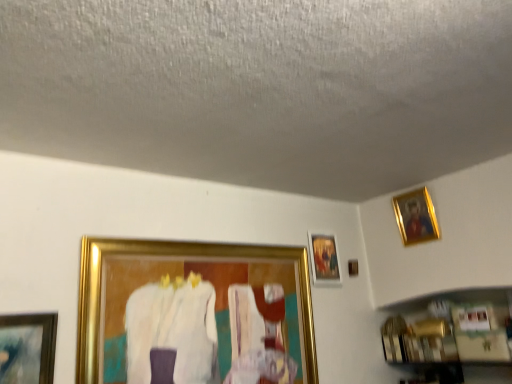
In order to face gold metallic picture frame at upper right, the 3th picture frame positioned from the left, should I rotate leftwards or rightwards?

Turn right approximately 20.600 degrees to face it.

The image size is (512, 384). Describe the element at coordinates (177, 256) in the screenshot. I see `gold metallic picture frame at center-left, which is the first picture frame from left to right` at that location.

The height and width of the screenshot is (384, 512). What are the coordinates of `gold-framed painting at upper right, which is the second picture frame from left to right` in the screenshot? It's located at (324, 259).

Is gold-framed painting at upper right, which is counted as the second picture frame, starting from the right, positioned in front of gold metallic picture frame at upper right, the 3th picture frame positioned from the left?

No, it is not.

Could you measure the distance between gold-framed painting at upper right, which is counted as the second picture frame, starting from the right, and gold metallic picture frame at upper right, which is counted as the first picture frame, starting from the right?

They are 21.06 inches apart.

Is point (334, 241) closer or farther from the camera than point (426, 239)?

Point (334, 241) appears to be farther away from the viewer than point (426, 239).

How many degrees apart are the facing directions of gold metallic picture frame at upper right, the 3th picture frame positioned from the left, and gold-framed painting at upper right, which is the second picture frame from left to right?

They differ by 87.7 degrees in their facing directions.

How far apart are gold metallic picture frame at upper right, which is counted as the first picture frame, starting from the right, and gold-framed painting at upper right, which is the second picture frame from left to right?

gold metallic picture frame at upper right, which is counted as the first picture frame, starting from the right, is 21.06 inches away from gold-framed painting at upper right, which is the second picture frame from left to right.

Can gold-framed painting at upper right, which is counted as the second picture frame, starting from the right, be found inside gold metallic picture frame at upper right, the 3th picture frame positioned from the left?

No, gold-framed painting at upper right, which is counted as the second picture frame, starting from the right, is not surrounded by gold metallic picture frame at upper right, the 3th picture frame positioned from the left.

From a real-world perspective, is gold metallic picture frame at upper right, which is counted as the first picture frame, starting from the right, positioned above or below gold-framed painting at upper right, which is the second picture frame from left to right?

From a real-world perspective, gold metallic picture frame at upper right, which is counted as the first picture frame, starting from the right, is physically above gold-framed painting at upper right, which is the second picture frame from left to right.

Which object is thinner, gold metallic picture frame at upper right, the 3th picture frame positioned from the left, or gold metallic picture frame at center-left, arranged as the third picture frame when viewed from the right?

Thinner between the two is gold metallic picture frame at upper right, the 3th picture frame positioned from the left.

Measure the distance between gold metallic picture frame at upper right, which is counted as the first picture frame, starting from the right, and gold metallic picture frame at center-left, which is the first picture frame from left to right.

The distance of gold metallic picture frame at upper right, which is counted as the first picture frame, starting from the right, from gold metallic picture frame at center-left, which is the first picture frame from left to right, is 37.17 inches.

Who is taller, gold metallic picture frame at upper right, the 3th picture frame positioned from the left, or gold metallic picture frame at center-left, which is the first picture frame from left to right?

With more height is gold metallic picture frame at center-left, which is the first picture frame from left to right.

Considering the relative sizes of gold metallic picture frame at upper right, the 3th picture frame positioned from the left, and gold metallic picture frame at center-left, arranged as the third picture frame when viewed from the right, in the image provided, is gold metallic picture frame at upper right, the 3th picture frame positioned from the left, smaller than gold metallic picture frame at center-left, arranged as the third picture frame when viewed from the right,?

Correct, gold metallic picture frame at upper right, the 3th picture frame positioned from the left, occupies less space than gold metallic picture frame at center-left, arranged as the third picture frame when viewed from the right.

Between gold metallic picture frame at center-left, which is the first picture frame from left to right, and gold-framed painting at upper right, which is the second picture frame from left to right, which one appears on the right side from the viewer's perspective?

Positioned to the right is gold-framed painting at upper right, which is the second picture frame from left to right.

Considering the relative sizes of gold metallic picture frame at center-left, which is the first picture frame from left to right, and gold-framed painting at upper right, which is the second picture frame from left to right, in the image provided, is gold metallic picture frame at center-left, which is the first picture frame from left to right, wider than gold-framed painting at upper right, which is the second picture frame from left to right,?

Indeed, gold metallic picture frame at center-left, which is the first picture frame from left to right, has a greater width compared to gold-framed painting at upper right, which is the second picture frame from left to right.

Which of these two, gold metallic picture frame at center-left, which is the first picture frame from left to right, or gold-framed painting at upper right, which is counted as the second picture frame, starting from the right, is bigger?

gold metallic picture frame at center-left, which is the first picture frame from left to right.

Measure the distance between gold metallic picture frame at center-left, which is the first picture frame from left to right, and gold-framed painting at upper right, which is counted as the second picture frame, starting from the right.

A distance of 19.14 inches exists between gold metallic picture frame at center-left, which is the first picture frame from left to right, and gold-framed painting at upper right, which is counted as the second picture frame, starting from the right.

Can you see gold metallic picture frame at center-left, arranged as the third picture frame when viewed from the right, touching gold metallic picture frame at upper right, the 3th picture frame positioned from the left?

No, gold metallic picture frame at center-left, arranged as the third picture frame when viewed from the right, is not beside gold metallic picture frame at upper right, the 3th picture frame positioned from the left.

Can gold metallic picture frame at upper right, which is counted as the first picture frame, starting from the right, be found inside gold metallic picture frame at center-left, which is the first picture frame from left to right?

No, gold metallic picture frame at upper right, which is counted as the first picture frame, starting from the right, is not a part of gold metallic picture frame at center-left, which is the first picture frame from left to right.

From the image's perspective, is gold metallic picture frame at center-left, which is the first picture frame from left to right, above or below gold metallic picture frame at upper right, the 3th picture frame positioned from the left?

gold metallic picture frame at center-left, which is the first picture frame from left to right, is situated lower than gold metallic picture frame at upper right, the 3th picture frame positioned from the left, in the image.

From the image's perspective, starting from the gold metallic picture frame at upper right, which is counted as the first picture frame, starting from the right, which picture frame is the 2nd one below? Please provide its 2D coordinates.

[(177, 256)]

Does gold-framed painting at upper right, which is counted as the second picture frame, starting from the right, have a greater height compared to gold metallic picture frame at center-left, arranged as the third picture frame when viewed from the right?

No, gold-framed painting at upper right, which is counted as the second picture frame, starting from the right, is not taller than gold metallic picture frame at center-left, arranged as the third picture frame when viewed from the right.

Considering the sizes of objects gold-framed painting at upper right, which is counted as the second picture frame, starting from the right, and gold metallic picture frame at center-left, arranged as the third picture frame when viewed from the right, in the image provided, who is thinner, gold-framed painting at upper right, which is counted as the second picture frame, starting from the right, or gold metallic picture frame at center-left, arranged as the third picture frame when viewed from the right,?

Thinner between the two is gold-framed painting at upper right, which is counted as the second picture frame, starting from the right.

Where is `picture frame that is on the left side of gold-framed painting at upper right, which is the second picture frame from left to right`? Image resolution: width=512 pixels, height=384 pixels. picture frame that is on the left side of gold-framed painting at upper right, which is the second picture frame from left to right is located at coordinates (177, 256).

Which object is closer to the camera taking this photo, gold-framed painting at upper right, which is counted as the second picture frame, starting from the right, or gold metallic picture frame at center-left, which is the first picture frame from left to right?

gold metallic picture frame at center-left, which is the first picture frame from left to right, is closer to the camera.

In order to click on picture frame behind the gold metallic picture frame at upper right, which is counted as the first picture frame, starting from the right in this screenshot , I will do `click(324, 259)`.

In the image, there is a gold-framed painting at upper right, which is the second picture frame from left to right. At what (x,y) coordinates should I click in order to perform the action: click on picture frame above it (from the image's perspective). Please return your answer as a coordinate pair (x, y). The width and height of the screenshot is (512, 384). Looking at the image, I should click on (416, 217).

From the image, which object appears to be nearer to gold metallic picture frame at upper right, which is counted as the first picture frame, starting from the right, gold-framed painting at upper right, which is counted as the second picture frame, starting from the right, or gold metallic picture frame at center-left, which is the first picture frame from left to right?

gold-framed painting at upper right, which is counted as the second picture frame, starting from the right.

Based on their spatial positions, is gold metallic picture frame at upper right, which is counted as the first picture frame, starting from the right, or gold-framed painting at upper right, which is the second picture frame from left to right, further from gold metallic picture frame at center-left, which is the first picture frame from left to right?

gold metallic picture frame at upper right, which is counted as the first picture frame, starting from the right, is further to gold metallic picture frame at center-left, which is the first picture frame from left to right.

Looking at the image, which one is located further to gold-framed painting at upper right, which is counted as the second picture frame, starting from the right, gold metallic picture frame at center-left, arranged as the third picture frame when viewed from the right, or gold metallic picture frame at upper right, which is counted as the first picture frame, starting from the right?

gold metallic picture frame at upper right, which is counted as the first picture frame, starting from the right, lies further to gold-framed painting at upper right, which is counted as the second picture frame, starting from the right, than the other object.

Looking at the image, which one is located closer to gold-framed painting at upper right, which is the second picture frame from left to right, gold metallic picture frame at upper right, the 3th picture frame positioned from the left, or gold metallic picture frame at center-left, which is the first picture frame from left to right?

gold metallic picture frame at center-left, which is the first picture frame from left to right, is positioned closer to the anchor gold-framed painting at upper right, which is the second picture frame from left to right.

When comparing their distances from gold metallic picture frame at upper right, the 3th picture frame positioned from the left, does gold metallic picture frame at center-left, arranged as the third picture frame when viewed from the right, or gold-framed painting at upper right, which is the second picture frame from left to right, seem closer?

Based on the image, gold-framed painting at upper right, which is the second picture frame from left to right, appears to be nearer to gold metallic picture frame at upper right, the 3th picture frame positioned from the left.

When comparing their distances from gold metallic picture frame at center-left, arranged as the third picture frame when viewed from the right, does gold-framed painting at upper right, which is the second picture frame from left to right, or gold metallic picture frame at upper right, the 3th picture frame positioned from the left, seem further?

The object further to gold metallic picture frame at center-left, arranged as the third picture frame when viewed from the right, is gold metallic picture frame at upper right, the 3th picture frame positioned from the left.

At what (x,y) coordinates should I click in order to perform the action: click on picture frame between gold metallic picture frame at center-left, arranged as the third picture frame when viewed from the right, and gold metallic picture frame at upper right, the 3th picture frame positioned from the left, in the horizontal direction. Please return your answer as a coordinate pair (x, y). This screenshot has height=384, width=512. Looking at the image, I should click on (324, 259).